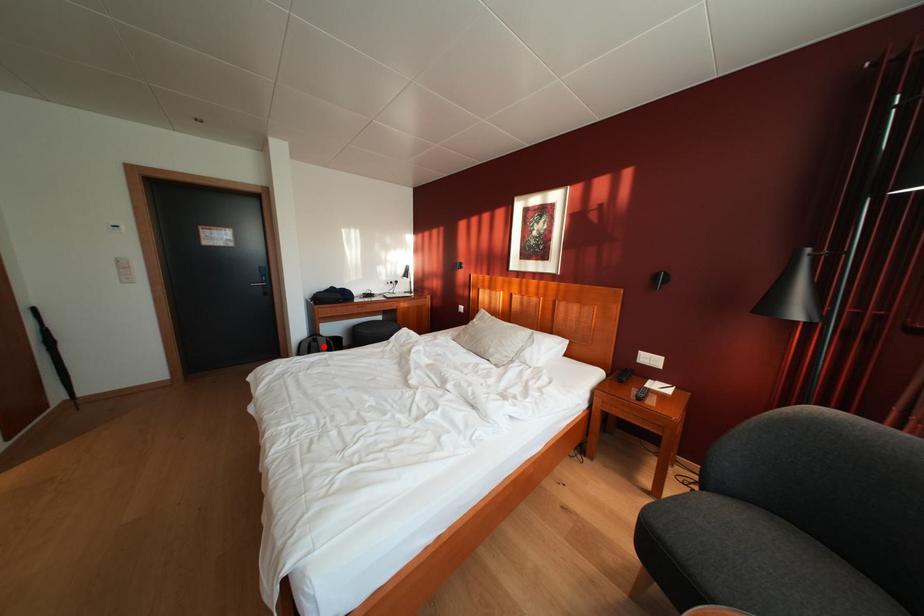
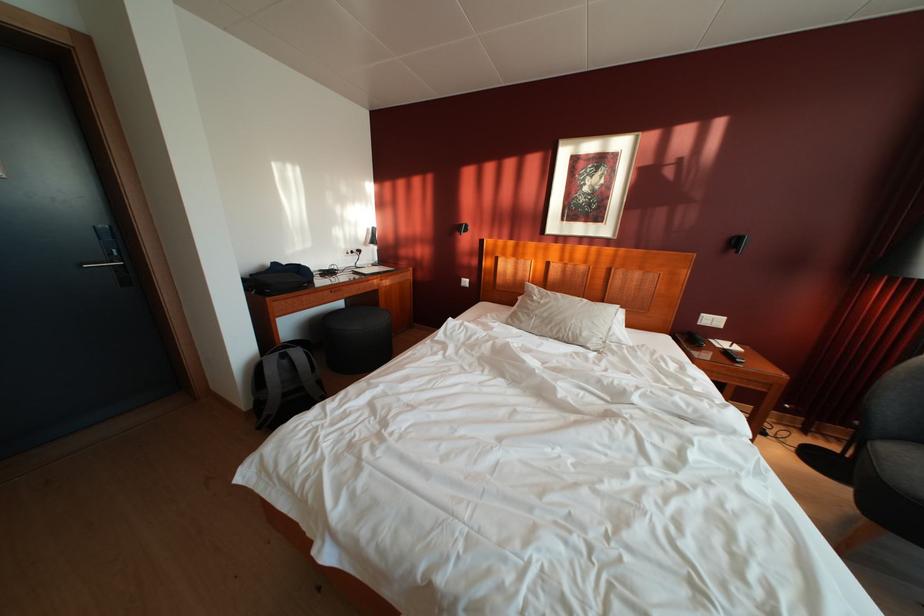
Question: I am providing you with two images of the same scene from different viewpoints. Image1 has a red point marked. In image2, the corresponding 3D location appears at what relative position? Reply with the corresponding letter.

Choices:
 (A) Closer
 (B) Farther

Answer: (B)